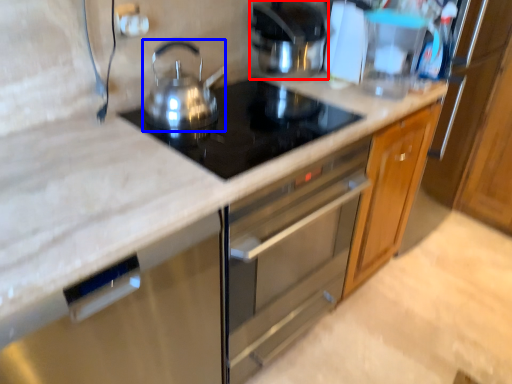
Question: Which point is closer to the camera, kitchen appliance (highlighted by a red box) or kitchen appliance (highlighted by a blue box)?

Choices:
 (A) kitchen appliance
 (B) kitchen appliance

Answer: (B)